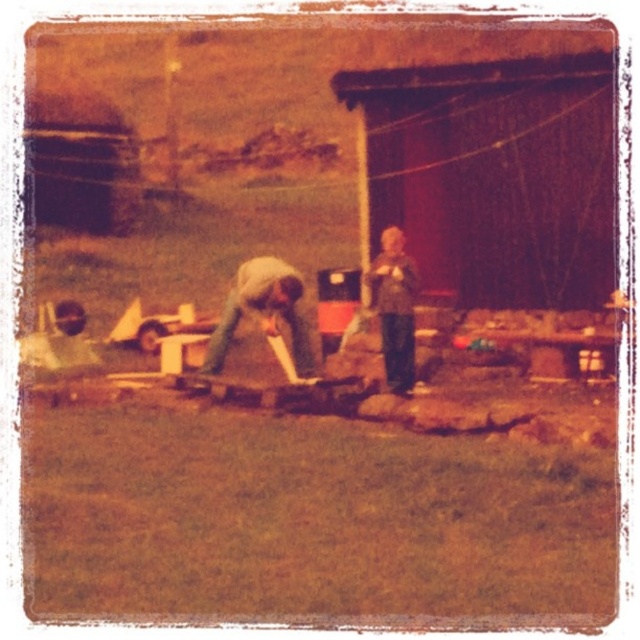
Question: Considering the relative positions of denim jacket at center and textured gray sweater at center in the image provided, where is denim jacket at center located with respect to textured gray sweater at center?

Choices:
 (A) left
 (B) right

Answer: (A)

Question: Which point is closer to the camera?

Choices:
 (A) (257, 262)
 (B) (406, 360)

Answer: (B)

Question: Which object is farther from the camera taking this photo?

Choices:
 (A) textured gray sweater at center
 (B) denim jacket at center

Answer: (A)

Question: From the image, what is the correct spatial relationship of denim jacket at center in relation to textured gray sweater at center?

Choices:
 (A) above
 (B) below

Answer: (B)

Question: Does denim jacket at center appear over textured gray sweater at center?

Choices:
 (A) no
 (B) yes

Answer: (A)